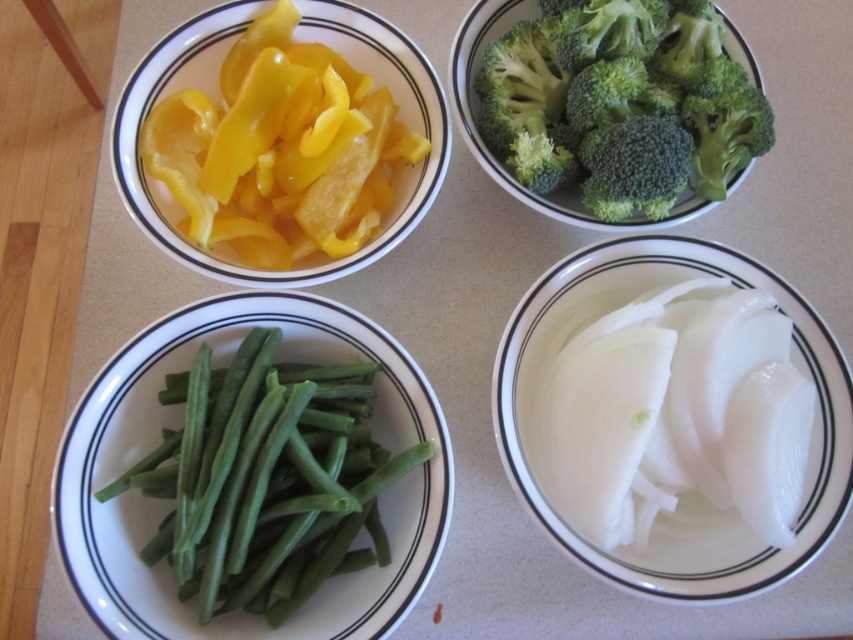
Question: Can you confirm if green matte green beans at lower left is thinner than yellow glossy bell pepper at upper left?

Choices:
 (A) no
 (B) yes

Answer: (A)

Question: Which object is farther from the camera taking this photo?

Choices:
 (A) white translucent onion at lower right
 (B) green matte green beans at lower left
 (C) yellow glossy bell pepper at upper left
 (D) green broccoli at upper center

Answer: (D)

Question: Is white translucent onion at lower right thinner than yellow glossy bell pepper at upper left?

Choices:
 (A) no
 (B) yes

Answer: (A)

Question: Which point is closer to the camera taking this photo?

Choices:
 (A) (138, 371)
 (B) (675, 563)
 (C) (199, 42)

Answer: (A)

Question: Can you confirm if green matte green beans at lower left is positioned above white translucent onion at lower right?

Choices:
 (A) yes
 (B) no

Answer: (B)

Question: Which of the following is the farthest from the observer?

Choices:
 (A) green matte green beans at lower left
 (B) white translucent onion at lower right
 (C) green broccoli at upper center

Answer: (C)